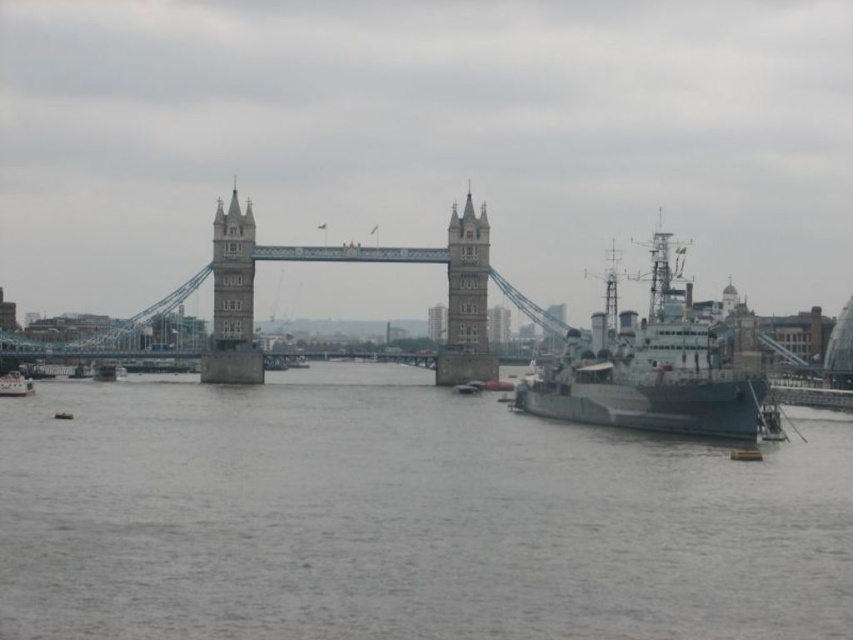
Question: Is stone tower at center to the right of stone steeple at center from the viewer's perspective?

Choices:
 (A) no
 (B) yes

Answer: (A)

Question: Estimate the real-world distances between objects in this image. Which object is closer to the dark gray metallic ship at right?

Choices:
 (A) stone steeple at center
 (B) white plastic boat at lower left
 (C) gray water at center

Answer: (A)

Question: Is dark gray metallic ship at right thinner than white plastic boat at lower left?

Choices:
 (A) yes
 (B) no

Answer: (B)

Question: Which of the following is the farthest from the observer?

Choices:
 (A) (566, 401)
 (B) (218, 305)
 (C) (0, 380)

Answer: (C)

Question: Does gray water at center appear on the left side of white plastic boat at lower left?

Choices:
 (A) no
 (B) yes

Answer: (A)

Question: Which of the following is the farthest from the observer?

Choices:
 (A) (579, 342)
 (B) (463, 339)

Answer: (B)